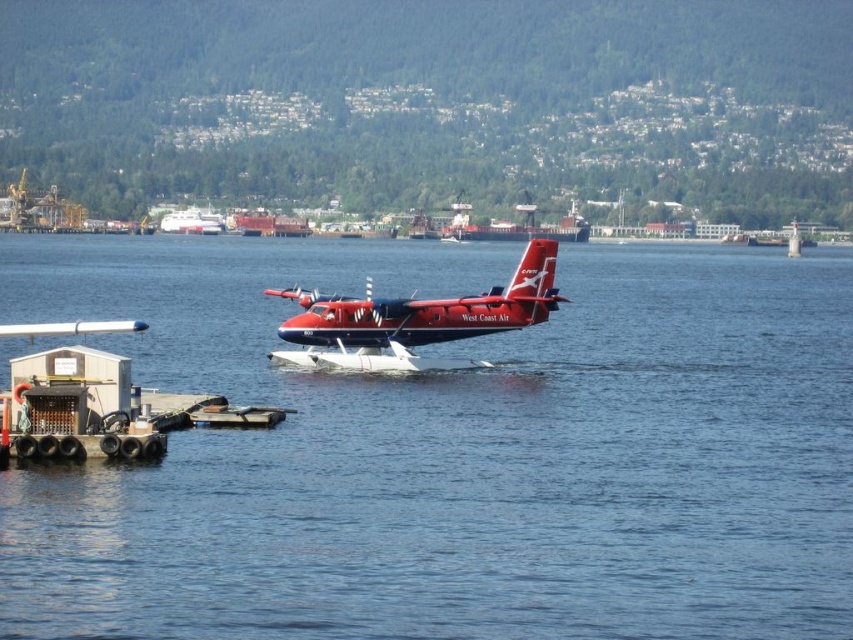
In the scene shown: Does matte red seaplane at center have a smaller size compared to white plastic boat at center?

Incorrect, matte red seaplane at center is not smaller in size than white plastic boat at center.

Between point (392, 321) and point (218, 225), which one is positioned in front?

Point (392, 321)

Find the location of a particular element. Image resolution: width=853 pixels, height=640 pixels. matte red seaplane at center is located at coordinates (415, 321).

Who is lower down, blue water at center or white plastic boat at center?

Positioned lower is blue water at center.

The height and width of the screenshot is (640, 853). What do you see at coordinates (453, 452) in the screenshot?
I see `blue water at center` at bounding box center [453, 452].

Is point (641, 380) less distant than point (177, 209)?

Yes, it is in front of point (177, 209).

This screenshot has height=640, width=853. Find the location of `blue water at center`. blue water at center is located at coordinates (453, 452).

Does blue water at center have a greater width compared to matte red seaplane at center?

Yes.

This screenshot has width=853, height=640. What do you see at coordinates (453, 452) in the screenshot?
I see `blue water at center` at bounding box center [453, 452].

Is point (627, 344) positioned before point (514, 316)?

No, (627, 344) is further to viewer.

Where is `blue water at center`? blue water at center is located at coordinates (453, 452).